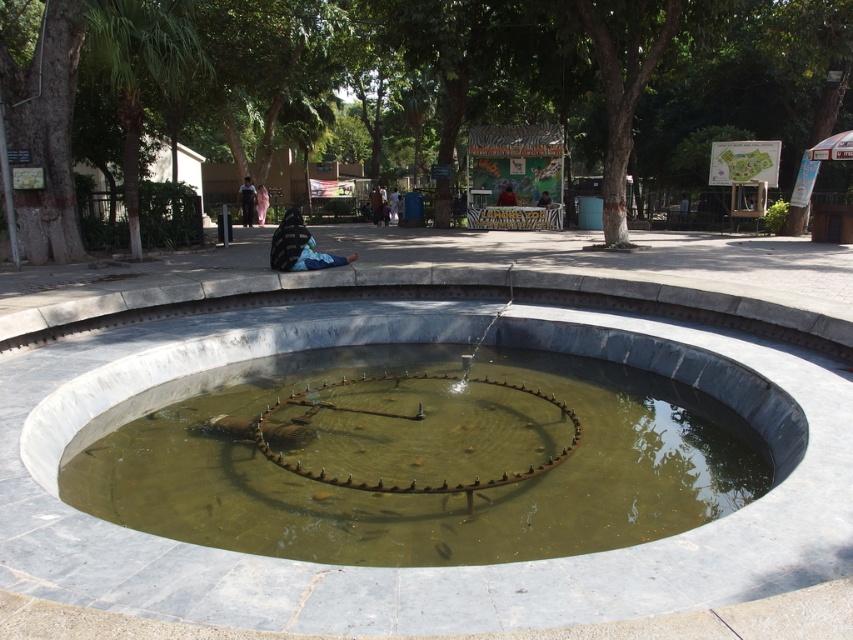
Is brown bark tree at center taller than light brown fabric shirt at center?

Yes.

Which is above, brown bark tree at center or light brown fabric shirt at center?

brown bark tree at center

Does point (788, 68) come farther from viewer compared to point (241, 209)?

No, (788, 68) is closer to viewer.

Identify the location of brown bark tree at center. (421, 77).

Can you confirm if greenish concrete water at center is positioned to the left of light brown fabric shirt at center?

In fact, greenish concrete water at center is to the right of light brown fabric shirt at center.

Who is more distant from viewer, [657,397] or [251,209]?

Point [251,209]

Where is `greenish concrete water at center`? Image resolution: width=853 pixels, height=640 pixels. greenish concrete water at center is located at coordinates (416, 458).

Is brown bark tree at center taller than greenish concrete water at center?

Indeed, brown bark tree at center has a greater height compared to greenish concrete water at center.

Locate an element on the screen. brown bark tree at center is located at coordinates (421, 77).

Image resolution: width=853 pixels, height=640 pixels. In order to click on brown bark tree at center in this screenshot , I will do `click(421, 77)`.